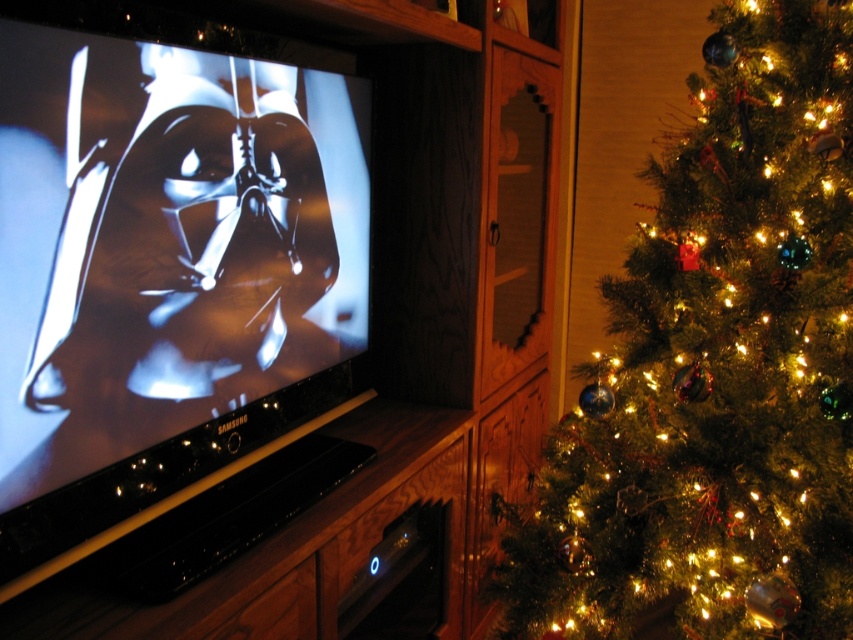
Is black glossy entertainment center at center thinner than green matte christmas tree at right?

Incorrect, black glossy entertainment center at center's width is not less than green matte christmas tree at right's.

Between black glossy entertainment center at center and green matte christmas tree at right, which one appears on the right side from the viewer's perspective?

green matte christmas tree at right

This screenshot has height=640, width=853. Describe the element at coordinates (270, 316) in the screenshot. I see `black glossy entertainment center at center` at that location.

I want to click on black glossy entertainment center at center, so click(x=270, y=316).